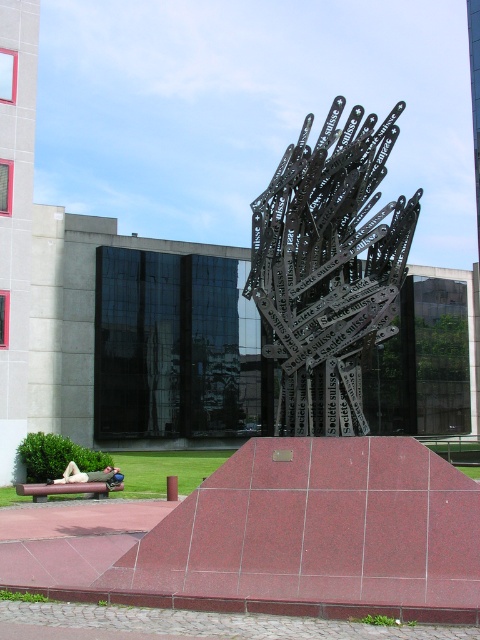
Question: Does metallic chainsaw blades at center appear under light beige fabric at lower left?

Choices:
 (A) yes
 (B) no

Answer: (B)

Question: Is metallic chainsaw blades at center positioned before light beige fabric at lower left?

Choices:
 (A) yes
 (B) no

Answer: (A)

Question: Among these objects, which one is farthest from the camera?

Choices:
 (A) metallic chainsaw blades at center
 (B) light beige fabric at lower left

Answer: (B)

Question: Which point is farther to the camera?

Choices:
 (A) light beige fabric at lower left
 (B) metallic chainsaw blades at center

Answer: (A)

Question: Can you confirm if metallic chainsaw blades at center is positioned above light beige fabric at lower left?

Choices:
 (A) yes
 (B) no

Answer: (A)

Question: Which object appears closest to the camera in this image?

Choices:
 (A) light beige fabric at lower left
 (B) metallic chainsaw blades at center

Answer: (B)